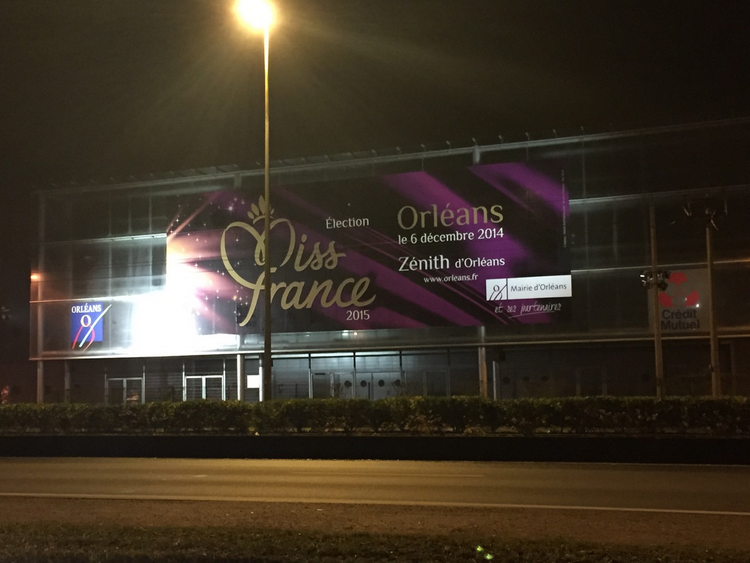
You are a GUI agent. You are given a task and a screenshot of the screen. Output one action in this format:
    pyautogui.click(x=<x>, y=<y>)
    Task: Click on the door
    
    Given the screenshot: What is the action you would take?
    point(196,387)